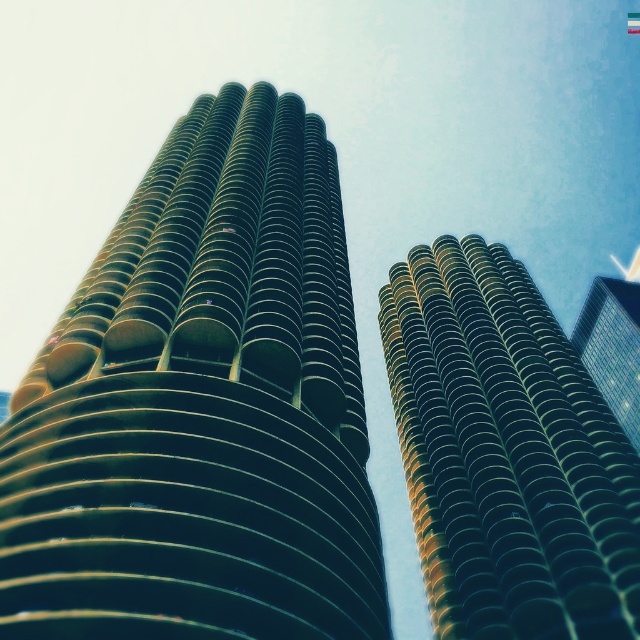
Describe the element at coordinates (506, 454) in the screenshot. The height and width of the screenshot is (640, 640). I see `green glass building at center` at that location.

Does green glass building at center have a lesser height compared to green glass skyscraper at right?

No, green glass building at center is not shorter than green glass skyscraper at right.

Between point (593, 596) and point (632, 289), which one is positioned in front?

Point (593, 596) is more forward.

This screenshot has width=640, height=640. What are the coordinates of `green glass building at center` in the screenshot? It's located at (506, 454).

Can you confirm if green matte tower at center is bigger than green glass skyscraper at right?

Indeed, green matte tower at center has a larger size compared to green glass skyscraper at right.

Does green matte tower at center appear over green glass skyscraper at right?

Yes.

Image resolution: width=640 pixels, height=640 pixels. What do you see at coordinates (202, 406) in the screenshot?
I see `green matte tower at center` at bounding box center [202, 406].

Identify the location of green matte tower at center. pos(202,406).

How much distance is there between green matte tower at center and green glass building at center?

green matte tower at center and green glass building at center are 124.38 feet apart from each other.

Does green matte tower at center have a lesser height compared to green glass building at center?

Incorrect, green matte tower at center's height does not fall short of green glass building at center's.

Locate an element on the screen. The image size is (640, 640). green matte tower at center is located at coordinates (202, 406).

The height and width of the screenshot is (640, 640). I want to click on green matte tower at center, so click(x=202, y=406).